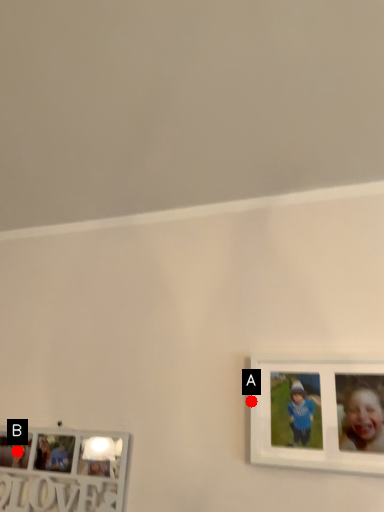
Question: Two points are circled on the image, labeled by A and B beside each circle. Which point is further to the camera?

Choices:
 (A) A is further
 (B) B is further

Answer: (B)